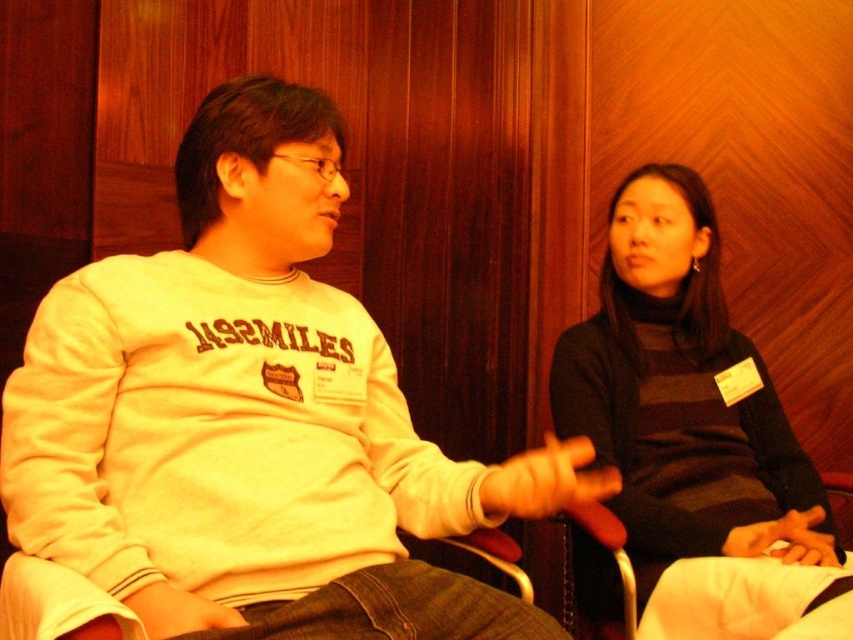
Question: Is white fleece sweatshirt at center positioned in front of dark gray sweater at center?

Choices:
 (A) yes
 (B) no

Answer: (A)

Question: Which object is closer to the camera taking this photo?

Choices:
 (A) dark gray sweater at center
 (B) white fleece sweatshirt at center

Answer: (B)

Question: Is white fleece sweatshirt at center positioned behind dark gray sweater at center?

Choices:
 (A) no
 (B) yes

Answer: (A)

Question: Can you confirm if white fleece sweatshirt at center is positioned below dark gray sweater at center?

Choices:
 (A) yes
 (B) no

Answer: (B)